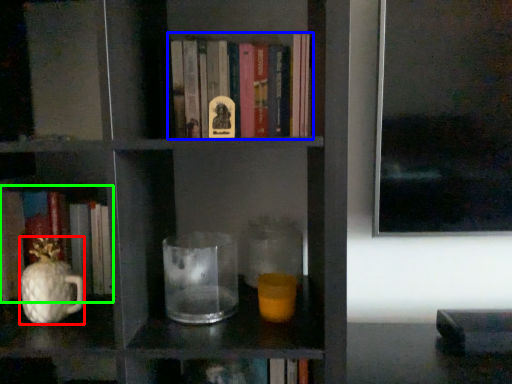
Question: Considering the real-world distances, which object is farthest from glass vase (highlighted by a red box)? book (highlighted by a blue box) or book (highlighted by a green box)?

Choices:
 (A) book
 (B) book

Answer: (A)